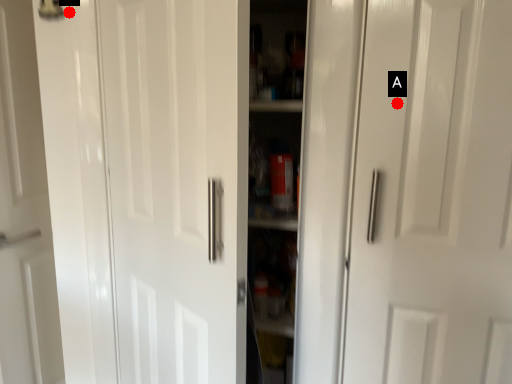
Question: Two points are circled on the image, labeled by A and B beside each circle. Which point appears farthest from the camera in this image?

Choices:
 (A) A is further
 (B) B is further

Answer: (B)